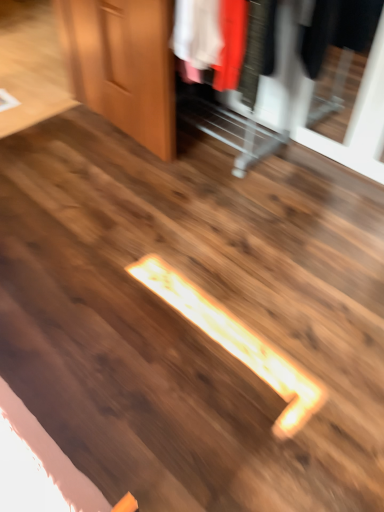
Locate an element on the screen. vacant area situated below wooden dresser at upper right (from a real-world perspective) is located at coordinates (212, 139).